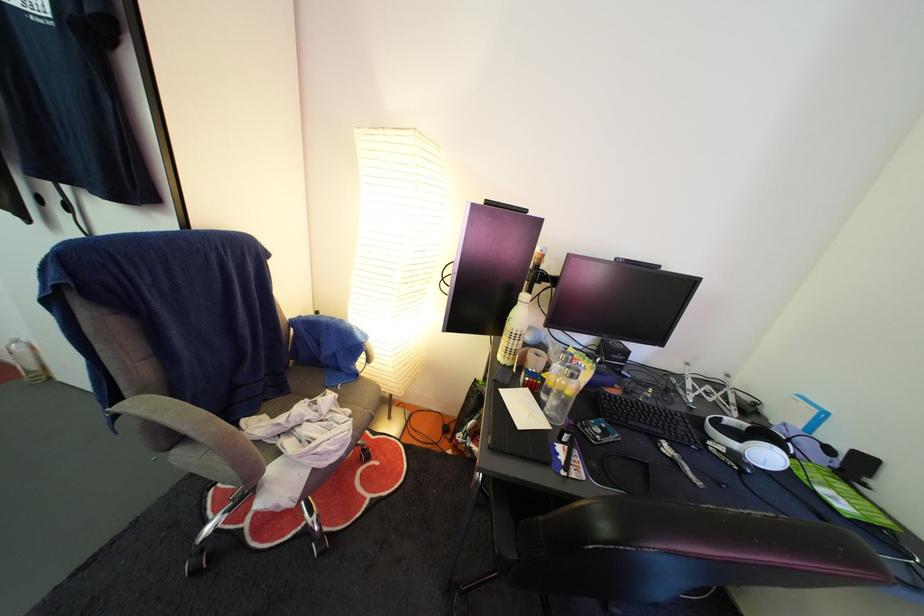
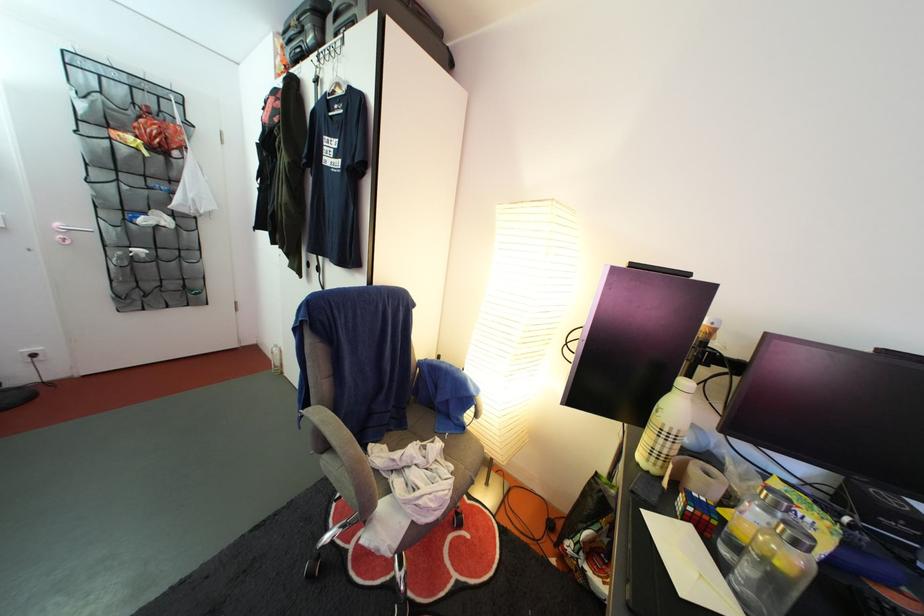
Question: The camera is either moving clockwise (left) or counter-clockwise (right) around the object. The first image is from the beginning of the video and the second image is from the end. Is the camera moving left or right when shooting the video?

Choices:
 (A) Left
 (B) Right

Answer: (B)